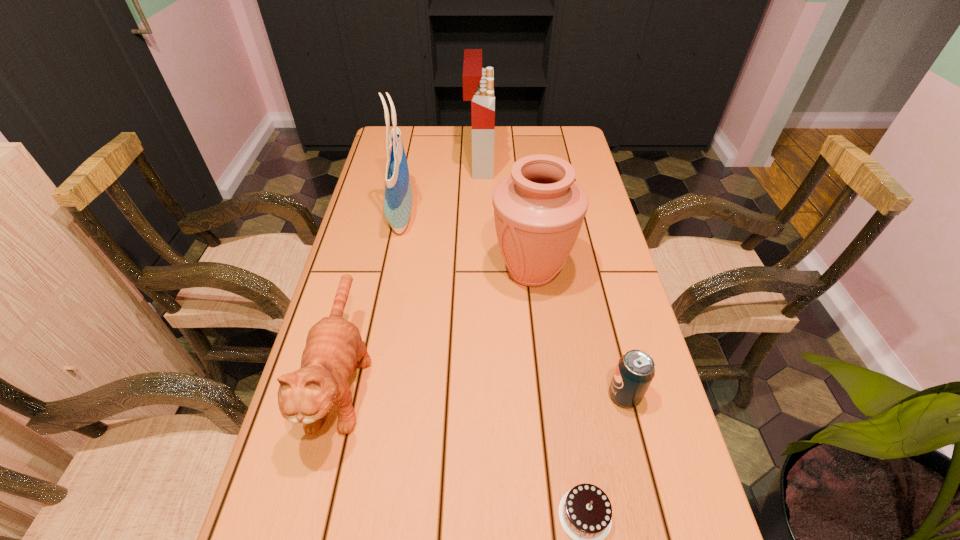
Find the location of a particular element. This screenshot has height=540, width=960. free region at the far right corner of the desktop is located at coordinates (575, 139).

This screenshot has height=540, width=960. Identify the location of free space between the tote bag and the rightmost object. (513, 305).

Locate an element on the screen. free spot between the cat and the tote bag is located at coordinates (372, 296).

In order to click on vacant area between the tote bag and the vase in this screenshot , I will do `click(467, 243)`.

This screenshot has height=540, width=960. Identify the location of vacant area that lies between the vase and the tote bag. (467, 243).

Where is `vacant area between the tote bag and the cigarette case`? The image size is (960, 540). vacant area between the tote bag and the cigarette case is located at coordinates (x=441, y=189).

The width and height of the screenshot is (960, 540). I want to click on free spot between the farthest object and the cat, so click(411, 269).

Image resolution: width=960 pixels, height=540 pixels. I want to click on the third closest object to the vase, so click(334, 348).

Select which object is the fifth closest to the vase. Please provide its 2D coordinates. Your answer should be formatted as a tuple, i.e. [(x, y)], where the tuple contains the x and y coordinates of a point satisfying the conditions above.

[(585, 512)]

Locate an element on the screen. vacant space that satisfies the following two spatial constraints: 1. with the lid open on the vase; 2. on the right side of the cigarette case is located at coordinates (479, 271).